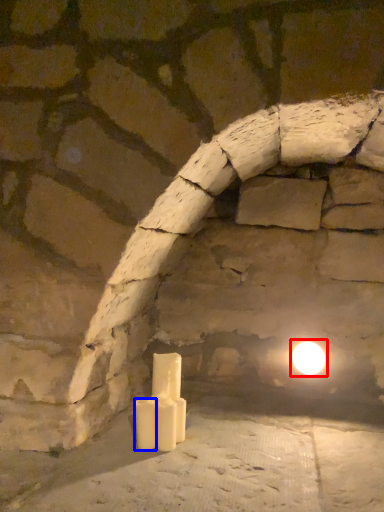
Question: Which point is closer to the camera, moonlight (highlighted by a red box) or candle (highlighted by a blue box)?

Choices:
 (A) moonlight
 (B) candle

Answer: (B)